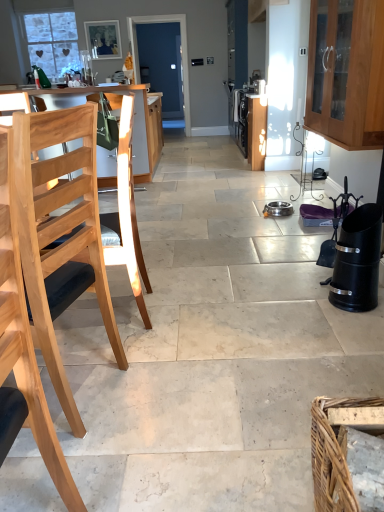
Identify the location of vacant space behind natural wood chair at left. (103, 345).